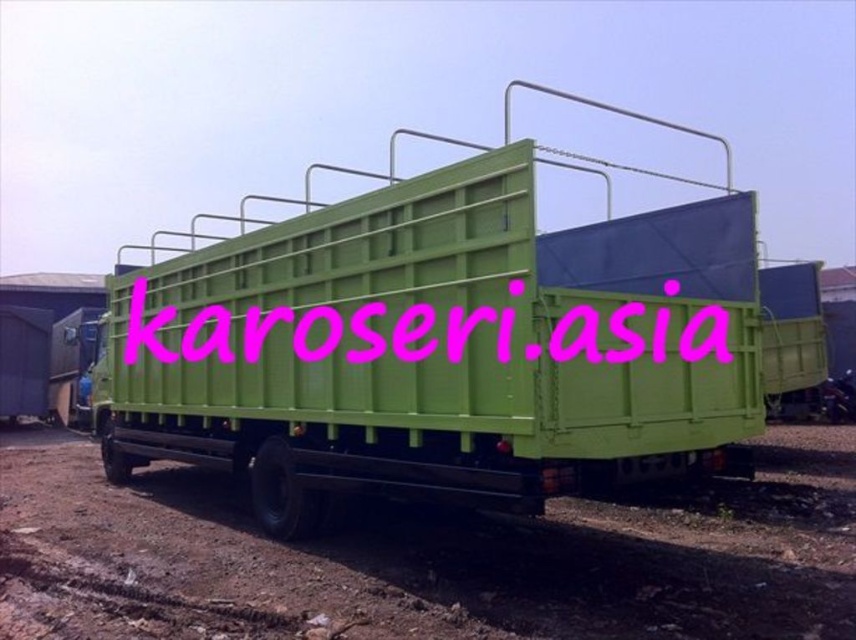
Is point (191, 492) closer to camera compared to point (645, 305)?

That is False.

At what (x,y) coordinates should I click in order to perform the action: click on dirt track at lower center. Please return your answer as a coordinate pair (x, y). The image size is (856, 640). Looking at the image, I should click on (426, 557).

Can you confirm if green matte truck at center is positioned to the right of dirt track at lower center?

In fact, green matte truck at center is to the left of dirt track at lower center.

Which is in front, point (574, 442) or point (385, 634)?

Point (385, 634) is more forward.

Locate an element on the screen. The width and height of the screenshot is (856, 640). green matte truck at center is located at coordinates (461, 344).

The image size is (856, 640). I want to click on green matte truck at center, so click(x=461, y=344).

Which is in front, point (632, 221) or point (547, 349)?

Positioned in front is point (547, 349).

At what (x,y) coordinates should I click in order to perform the action: click on green matte truck at center. Please return your answer as a coordinate pair (x, y). Image resolution: width=856 pixels, height=640 pixels. Looking at the image, I should click on (461, 344).